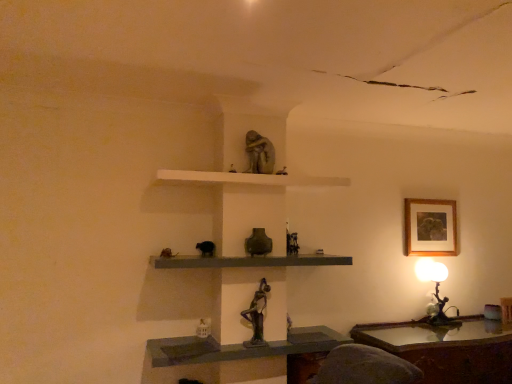
Question: Is metallic bronze figurine at right smaller than matte gray shelf at center, which ranks as the 2th shelf in bottom-to-top order?

Choices:
 (A) yes
 (B) no

Answer: (A)

Question: Considering the relative sizes of metallic bronze figurine at right and matte gray shelf at center, which ranks as the 2th shelf in bottom-to-top order, in the image provided, is metallic bronze figurine at right thinner than matte gray shelf at center, which ranks as the 2th shelf in bottom-to-top order,?

Choices:
 (A) yes
 (B) no

Answer: (A)

Question: Is matte gray shelf at center, acting as the second shelf starting from the top, at the back of metallic bronze figurine at right?

Choices:
 (A) yes
 (B) no

Answer: (B)

Question: From a real-world perspective, is metallic bronze figurine at right positioned under matte gray shelf at center, acting as the second shelf starting from the top, based on gravity?

Choices:
 (A) yes
 (B) no

Answer: (A)

Question: From the image's perspective, does metallic bronze figurine at right appear lower than matte gray shelf at center, acting as the second shelf starting from the top?

Choices:
 (A) no
 (B) yes

Answer: (B)

Question: Looking at the image, does white matte shelf at upper center, the 3th shelf when ordered from bottom to top, seem bigger or smaller compared to wooden polished table at lower right?

Choices:
 (A) small
 (B) big

Answer: (A)

Question: Relative to wooden polished table at lower right, is white matte shelf at upper center, which is the first shelf in top-to-bottom order, in front or behind?

Choices:
 (A) behind
 (B) front

Answer: (B)

Question: Considering the positions of point (190, 173) and point (488, 352), is point (190, 173) closer or farther from the camera than point (488, 352)?

Choices:
 (A) farther
 (B) closer

Answer: (B)

Question: From a real-world perspective, relative to wooden polished table at lower right, is white matte shelf at upper center, the 3th shelf when ordered from bottom to top, vertically above or below?

Choices:
 (A) below
 (B) above

Answer: (B)

Question: Does point (417, 228) appear closer or farther from the camera than point (437, 266)?

Choices:
 (A) closer
 (B) farther

Answer: (A)

Question: In the image, is wooden framed artwork at upper right on the left side or the right side of metallic bronze figurine at right?

Choices:
 (A) left
 (B) right

Answer: (A)

Question: Is wooden framed artwork at upper right in front of or behind metallic bronze figurine at right in the image?

Choices:
 (A) front
 (B) behind

Answer: (B)

Question: Is wooden framed artwork at upper right wider or thinner than metallic bronze figurine at right?

Choices:
 (A) thin
 (B) wide

Answer: (A)

Question: From a real-world perspective, is matte gray stone statue at upper center, placed as the 2th sculpture when sorted from bottom to top, positioned above or below wooden framed artwork at upper right?

Choices:
 (A) above
 (B) below

Answer: (A)

Question: Is matte gray stone statue at upper center, placed as the 2th sculpture when sorted from bottom to top, in front of or behind wooden framed artwork at upper right in the image?

Choices:
 (A) front
 (B) behind

Answer: (A)